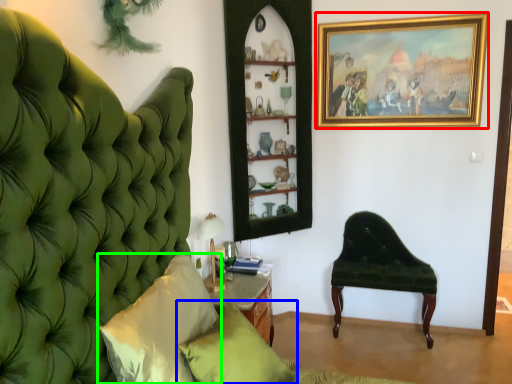
Question: Which object is the farthest from picture frame (highlighted by a red box)? Choose among these: pillow (highlighted by a blue box) or pillow (highlighted by a green box).

Choices:
 (A) pillow
 (B) pillow

Answer: (B)